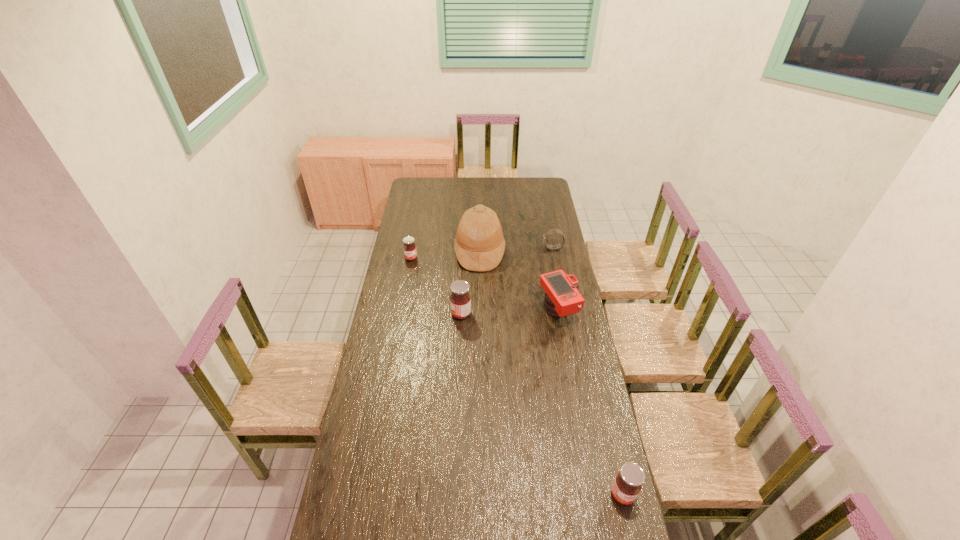
If equal spacing is the goal by inserting an additional jam among them, please point out a vacant space for this new jam. Please provide its 2D coordinates. Your answer should be formatted as a tuple, i.e. [(x, y)], where the tuple contains the x and y coordinates of a point satisfying the conditions above.

[(528, 389)]